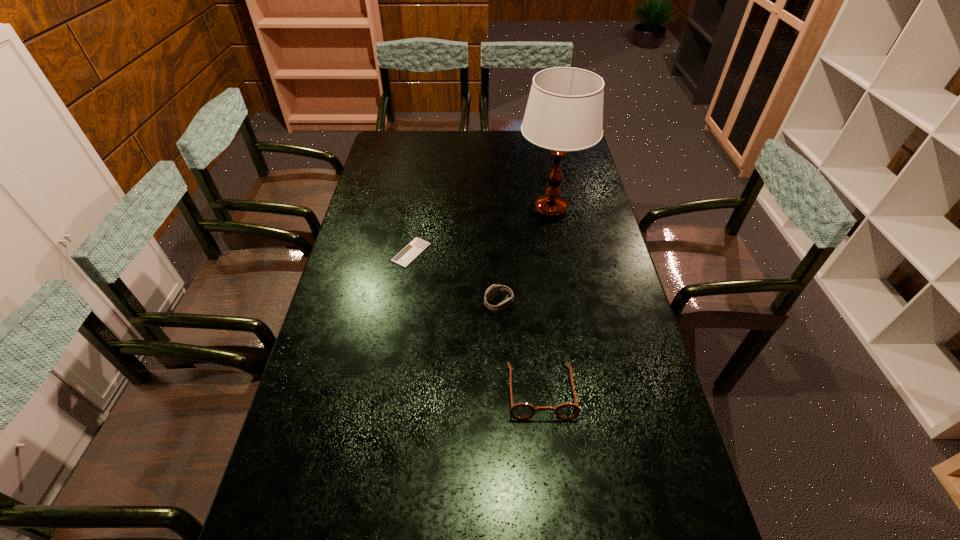
The height and width of the screenshot is (540, 960). In order to click on unoccupied position between the spectacles and the third nearest object in this screenshot , I will do `click(476, 322)`.

Identify the location of unoccupied position between the calculator and the second nearest object. The width and height of the screenshot is (960, 540). (455, 278).

At what (x,y) coordinates should I click in order to perform the action: click on empty space between the table lamp and the nearest object. Please return your answer as a coordinate pair (x, y). Image resolution: width=960 pixels, height=540 pixels. Looking at the image, I should click on (545, 300).

This screenshot has height=540, width=960. I want to click on free spot between the spectacles and the watch, so click(x=519, y=347).

You are a GUI agent. You are given a task and a screenshot of the screen. Output one action in this format:
    pyautogui.click(x=<x>, y=<y>)
    Task: Click on the vacant region between the nearest object and the watch
    The image size is (960, 540).
    Given the screenshot: What is the action you would take?
    pyautogui.click(x=519, y=347)

At what (x,y) coordinates should I click in order to perform the action: click on free spot between the leftmost object and the third farthest object. Please return your answer as a coordinate pair (x, y). This screenshot has height=540, width=960. Looking at the image, I should click on (455, 278).

At what (x,y) coordinates should I click in order to perform the action: click on free spot between the watch and the nearest object. Please return your answer as a coordinate pair (x, y). Image resolution: width=960 pixels, height=540 pixels. Looking at the image, I should click on (519, 347).

Choose which object is the third nearest neighbor to the farthest object. Please provide its 2D coordinates. Your answer should be formatted as a tuple, i.e. [(x, y)], where the tuple contains the x and y coordinates of a point satisfying the conditions above.

[(521, 411)]

Point out which object is positioned as the third nearest to the watch. Please provide its 2D coordinates. Your answer should be formatted as a tuple, i.e. [(x, y)], where the tuple contains the x and y coordinates of a point satisfying the conditions above.

[(564, 112)]